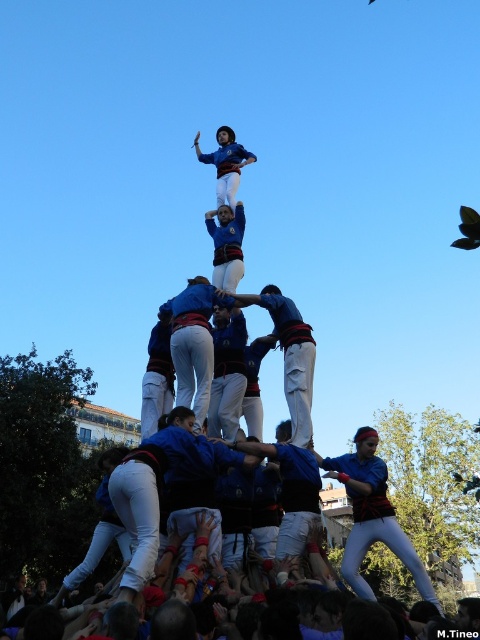
Question: Which of the following is the closest to the observer?

Choices:
 (A) (309, 419)
 (B) (215, 237)

Answer: (A)

Question: Can you confirm if blue fabric shirt at center is positioned above blue fabric at center?

Choices:
 (A) no
 (B) yes

Answer: (A)

Question: Which of the following is the closest to the observer?

Choices:
 (A) blue fabric shirt at center
 (B) blue fabric at center

Answer: (A)

Question: Does blue fabric shirt at center appear on the right side of blue fabric person at upper center?

Choices:
 (A) yes
 (B) no

Answer: (A)

Question: Can you confirm if blue fabric shirt at center is positioned to the left of blue fabric at center?

Choices:
 (A) no
 (B) yes

Answer: (A)

Question: Which of the following is the farthest from the observer?

Choices:
 (A) blue fabric shirt at center
 (B) blue fabric person at center

Answer: (B)